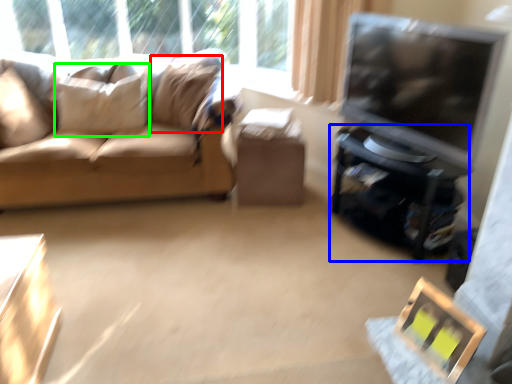
Question: Which object is the farthest from pillow (highlighted by a red box)? Choose among these: entertainment center (highlighted by a blue box) or pillow (highlighted by a green box).

Choices:
 (A) entertainment center
 (B) pillow

Answer: (A)